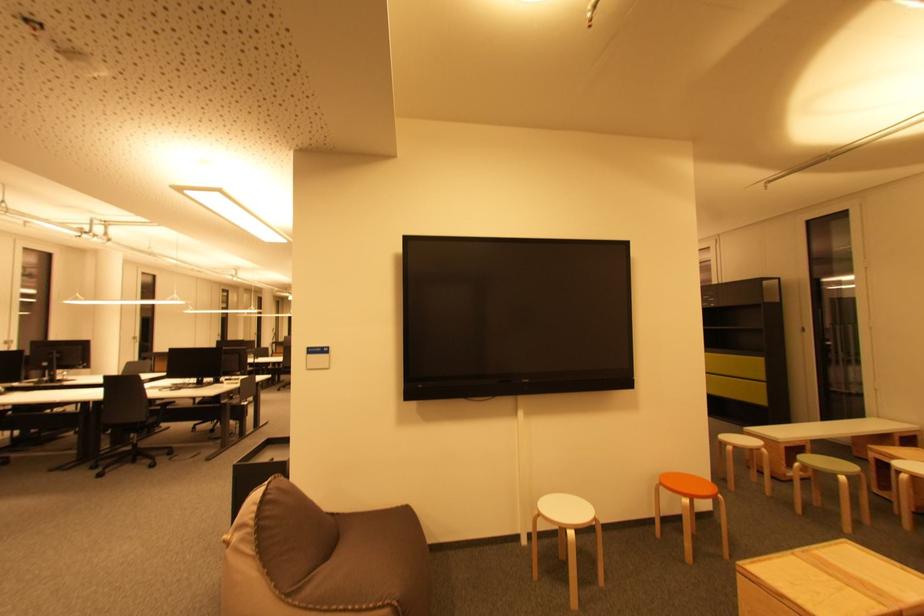
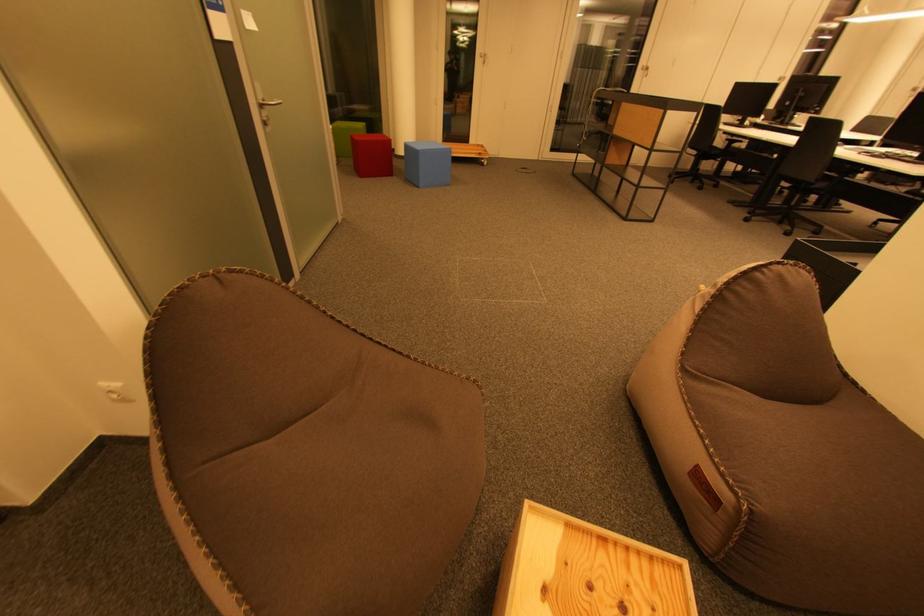
In the scene shown: First-person continuous shooting, in which direction is the camera rotating?

The camera rotated toward left-down.